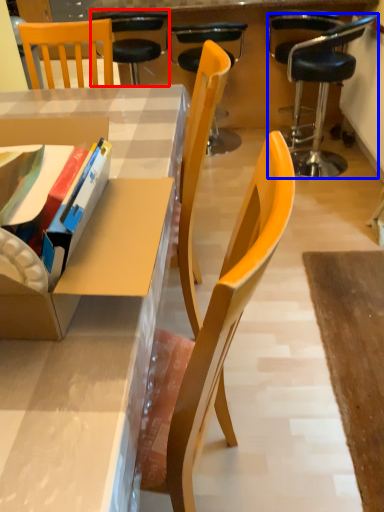
Question: Which object is further to the camera taking this photo, chair (highlighted by a red box) or chair (highlighted by a blue box)?

Choices:
 (A) chair
 (B) chair

Answer: (A)